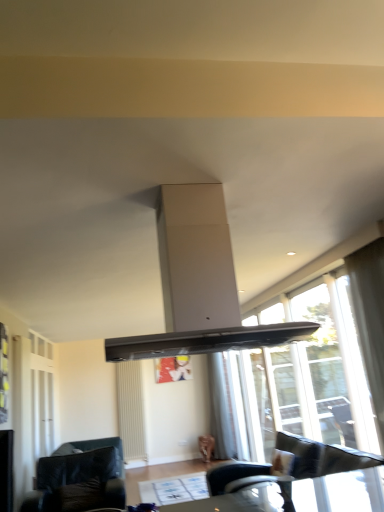
Question: From a real-world perspective, is white matte exhaust hood at center physically located above or below transparent glass window at right?

Choices:
 (A) above
 (B) below

Answer: (A)

Question: From their relative heights in the image, would you say white matte exhaust hood at center is taller or shorter than transparent glass window at right?

Choices:
 (A) tall
 (B) short

Answer: (B)

Question: Which is nearer to the transparent glass window at right?

Choices:
 (A) white matte radiator at lower left
 (B) white matte exhaust hood at center
 (C) white sheer curtain at center
 (D) black leather chair at lower right
 (E) matte black table at lower center

Answer: (D)

Question: Estimate the real-world distances between objects in this image. Which object is closer to the matte black table at lower center?

Choices:
 (A) black leather chair at lower right
 (B) transparent glass window at right
 (C) white matte exhaust hood at center
 (D) black leather couch at lower left
 (E) white matte radiator at lower left

Answer: (A)